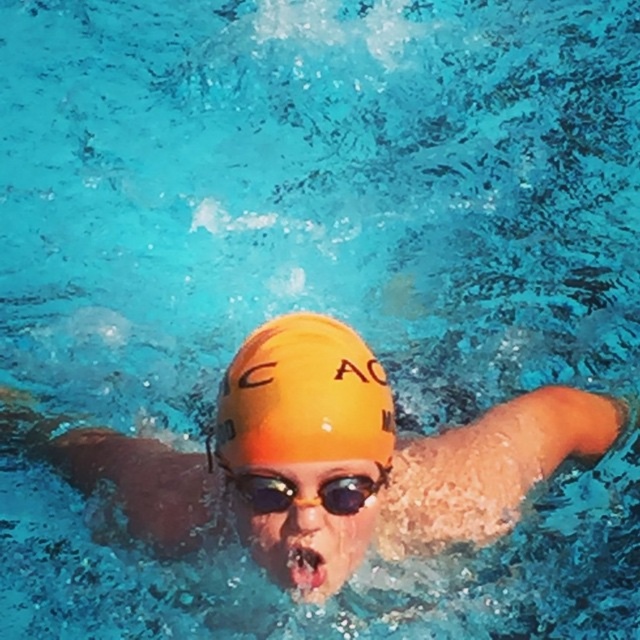
Does orange matte swim cap at center appear on the left side of yellow matte swim cap at center?

In fact, orange matte swim cap at center is to the right of yellow matte swim cap at center.

Is point (1, 416) positioned behind point (336, 326)?

That is True.

Where is `orange matte swim cap at center`? orange matte swim cap at center is located at coordinates (328, 460).

Can you confirm if yellow matte swim cap at center is wider than transparent yellow goggles at center?

Indeed, yellow matte swim cap at center has a greater width compared to transparent yellow goggles at center.

Does yellow matte swim cap at center have a larger size compared to transparent yellow goggles at center?

Yes, yellow matte swim cap at center is bigger than transparent yellow goggles at center.

The image size is (640, 640). Find the location of `yellow matte swim cap at center`. yellow matte swim cap at center is located at coordinates (304, 397).

Where is `orange matte swim cap at center`? This screenshot has width=640, height=640. orange matte swim cap at center is located at coordinates (328, 460).

Is point (488, 472) closer to camera compared to point (364, 476)?

No, it is not.

What do you see at coordinates (328, 460) in the screenshot? This screenshot has width=640, height=640. I see `orange matte swim cap at center` at bounding box center [328, 460].

You are a GUI agent. You are given a task and a screenshot of the screen. Output one action in this format:
    pyautogui.click(x=<x>, y=<y>)
    Task: Click on the orange matte swim cap at center
    This screenshot has width=640, height=640.
    Given the screenshot: What is the action you would take?
    pyautogui.click(x=328, y=460)